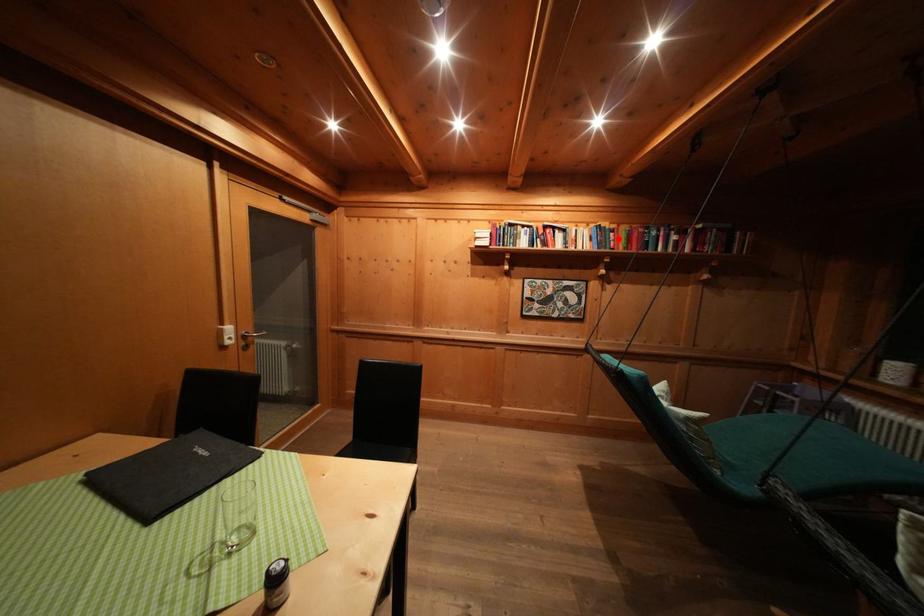
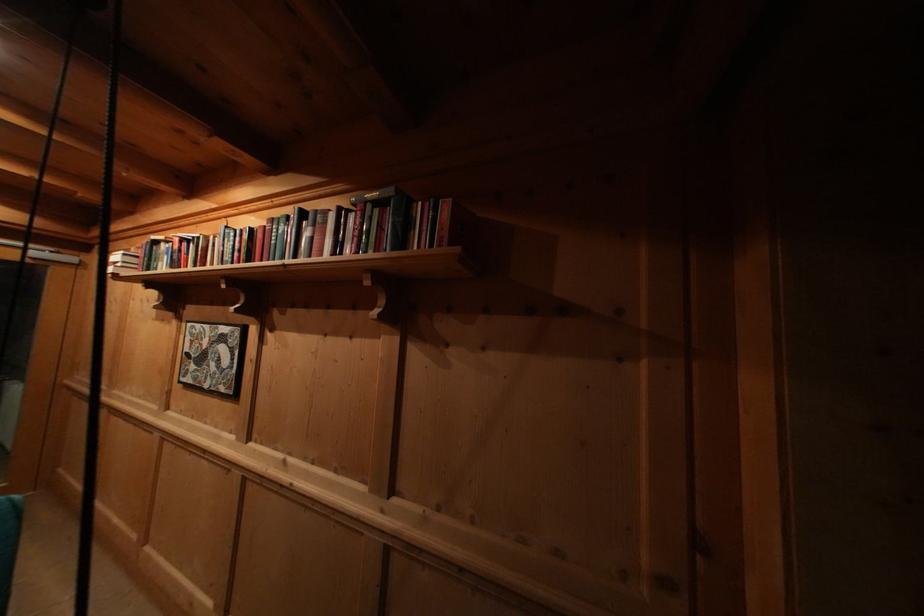
Question: I am providing you with two images of the same scene from different viewpoints. A red point is marked on the first image. Can you still see the location of the red point in image 2?

Choices:
 (A) Yes
 (B) No

Answer: (A)